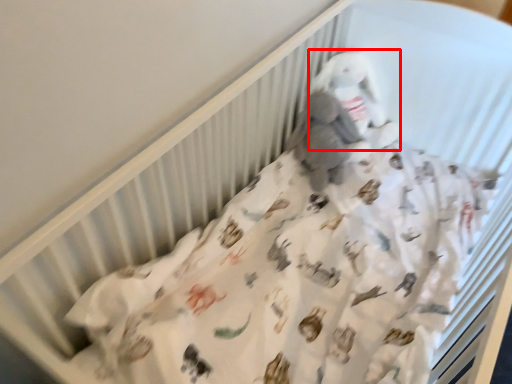
Question: From the image's perspective, considering the relative positions of toy (annotated by the red box) and baby elephant in the image provided, where is toy (annotated by the red box) located with respect to the staircase?

Choices:
 (A) below
 (B) above

Answer: (B)